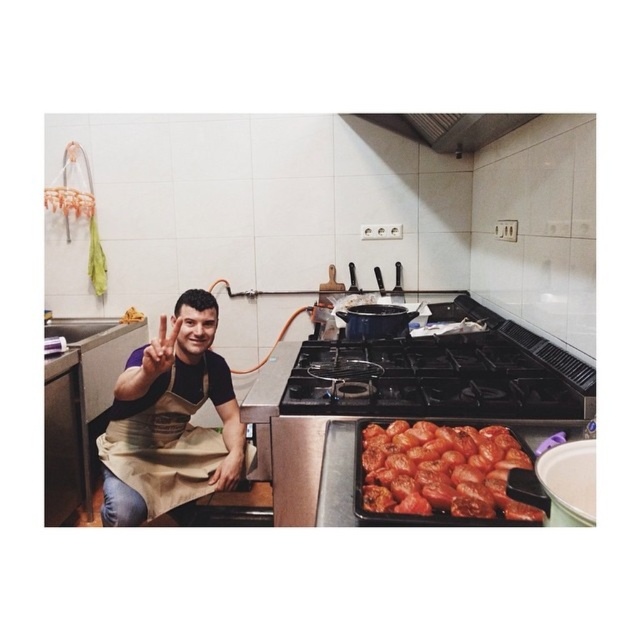
Can you confirm if shiny red tomatoes at center is shorter than metallic at upper center?

Indeed, shiny red tomatoes at center has a lesser height compared to metallic at upper center.

Does shiny red tomatoes at center have a smaller size compared to metallic at upper center?

Yes, shiny red tomatoes at center is smaller than metallic at upper center.

Is point (376, 422) less distant than point (429, 147)?

Yes, point (376, 422) is in front of point (429, 147).

The height and width of the screenshot is (640, 640). What are the coordinates of `shiny red tomatoes at center` in the screenshot? It's located at (444, 472).

Who is positioned more to the left, beige apron at center or shiny red tomatoes at center?

From the viewer's perspective, beige apron at center appears more on the left side.

Does beige apron at center appear on the left side of shiny red tomatoes at center?

Indeed, beige apron at center is positioned on the left side of shiny red tomatoes at center.

This screenshot has height=640, width=640. Describe the element at coordinates (170, 420) in the screenshot. I see `beige apron at center` at that location.

The width and height of the screenshot is (640, 640). Identify the location of beige apron at center. (x=170, y=420).

Which is more to the right, beige apron at center or metallic at upper center?

metallic at upper center

Consider the image. Is beige apron at center above metallic at upper center?

Incorrect, beige apron at center is not positioned above metallic at upper center.

Where is `beige apron at center`? beige apron at center is located at coordinates (170, 420).